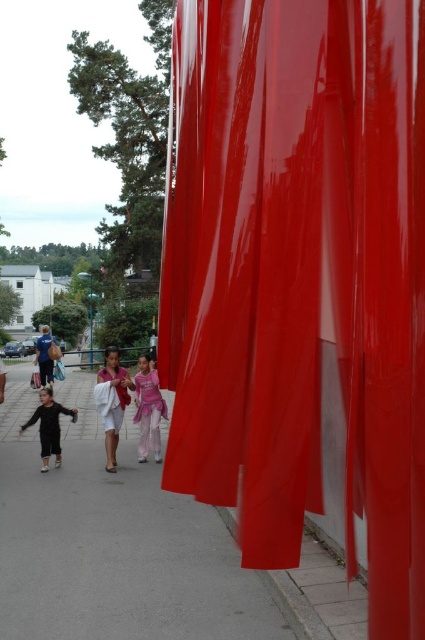
You are standing at the point labeled point [360,10] and want to walk to the point labeled point [59,352]. Based on the scene description, which direction should you move to get closer to your destination?

You should move downward and to the right because point [59,352] is located lower and to the right compared to point [360,10].

You are standing on the smooth concrete pavement at lower center and want to walk towards the matte blue jeans at left. Is the path clear in front of you?

Yes, the path is clear because the smooth concrete pavement at lower center is closer to the viewer than the matte blue jeans at left, meaning there is space between them.

You are standing at the point labeled point (124,481) and want to walk towards the point labeled point (50,355). Which direction should you face to move directly towards your destination?

Since point (124,481) is closer to the viewer than point (50,355), you should face towards the direction of the background to move directly towards point (50,355).